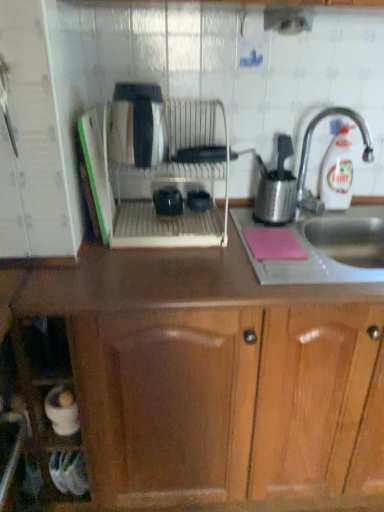
Where is `vacant region in front of black plastic bowls at center, arranged as the first appliance when viewed from the right`? The height and width of the screenshot is (512, 384). vacant region in front of black plastic bowls at center, arranged as the first appliance when viewed from the right is located at coordinates (201, 232).